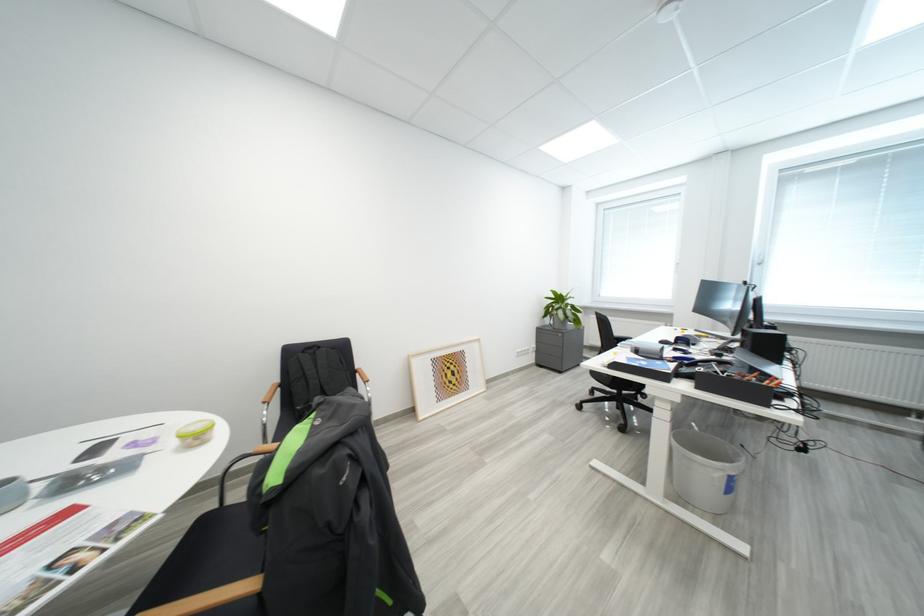
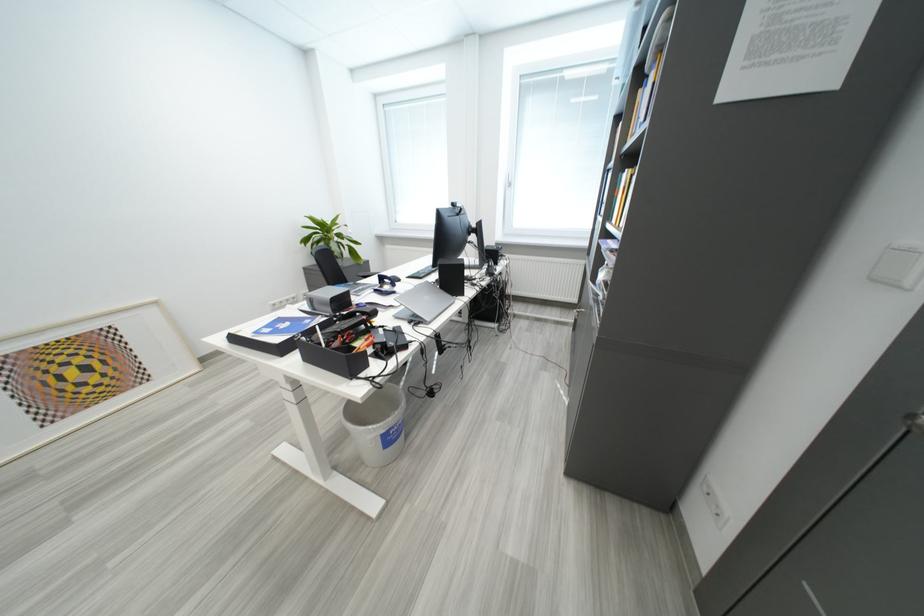
Find the pixel in the second image that matches [628,454] in the first image.

(343, 418)